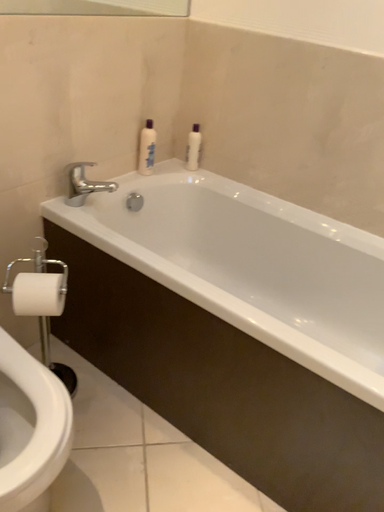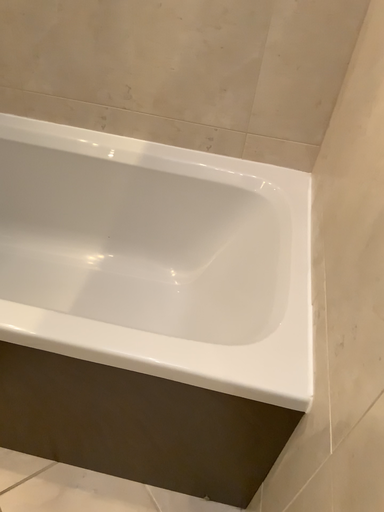
Question: Which way did the camera rotate in the video?

Choices:
 (A) rotated downward
 (B) rotated upward

Answer: (A)